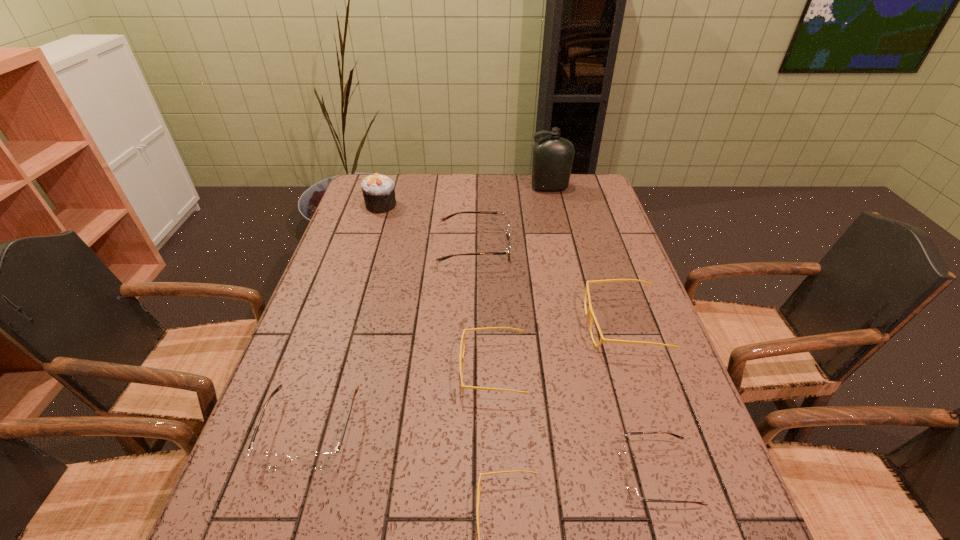
Locate an element on the screen. The width and height of the screenshot is (960, 540). object present at the far right corner is located at coordinates (553, 156).

Identify the location of vacant region at the far edge of the desktop. (520, 192).

You are a GUI agent. You are given a task and a screenshot of the screen. Output one action in this format:
    pyautogui.click(x=<x>, y=<y>)
    Task: Click on the free space at the left edge of the desktop
    
    Given the screenshot: What is the action you would take?
    pyautogui.click(x=297, y=427)

This screenshot has height=540, width=960. I want to click on free region at the right edge of the desktop, so click(615, 222).

At what (x,y) coordinates should I click in order to perform the action: click on vacant space that's between the rightmost beige spectacles and the bottle. Please return your answer as a coordinate pair (x, y). Image resolution: width=960 pixels, height=540 pixels. Looking at the image, I should click on (587, 256).

Find the location of `blank region between the second biggest beige spectacles and the second farthest object`. blank region between the second biggest beige spectacles and the second farthest object is located at coordinates (437, 287).

At what (x,y) coordinates should I click in order to perform the action: click on vacant space that's between the rightmost brown spectacles and the rightmost beige spectacles. Please return your answer as a coordinate pair (x, y). Looking at the image, I should click on (640, 400).

Find the location of a particular element. The height and width of the screenshot is (540, 960). empty space between the farthest object and the biggest beige spectacles is located at coordinates (587, 256).

Identify the location of vacant region between the leftmost spectacles and the second smallest beige spectacles. (402, 399).

Image resolution: width=960 pixels, height=540 pixels. I want to click on vacant area between the rightmost beige spectacles and the seventh shortest object, so click(502, 265).